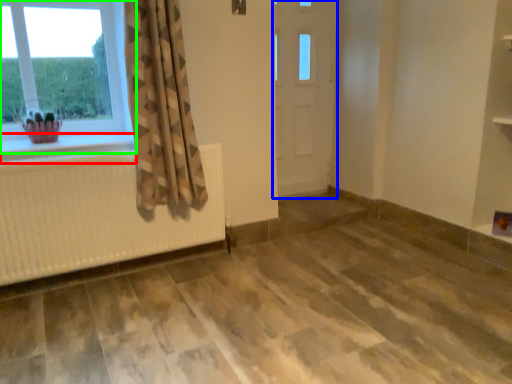
Question: Which object is the closest to the window sill (highlighted by a red box)? Choose among these: door (highlighted by a blue box) or window (highlighted by a green box).

Choices:
 (A) door
 (B) window

Answer: (B)